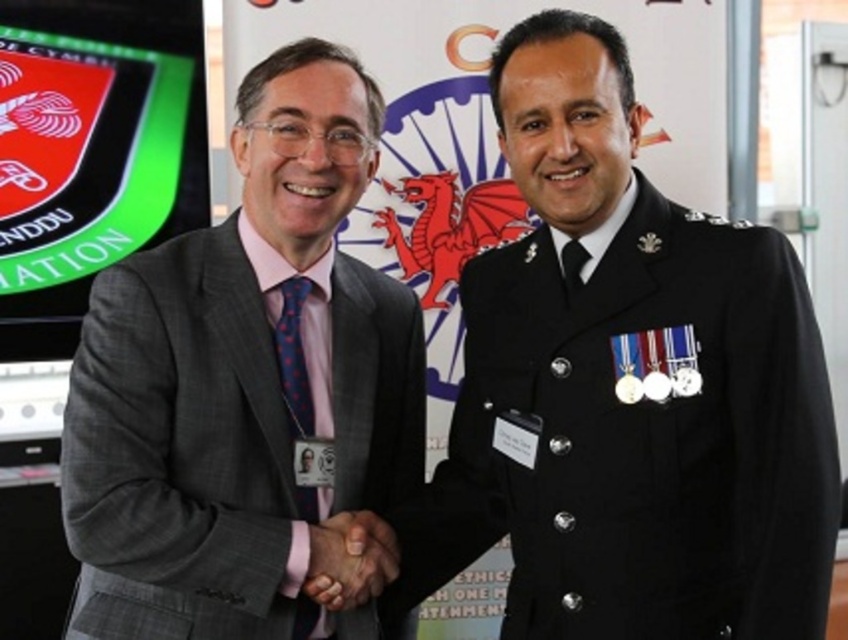
Who is shorter, black uniform at center or black satin tie at right?

Result: black satin tie at right

Can you confirm if black uniform at center is thinner than black satin tie at right?

Incorrect, black uniform at center's width is not less than black satin tie at right's.

Who is more forward, (590, 538) or (568, 269)?

Point (590, 538) is in front.

I want to click on black uniform at center, so click(x=628, y=388).

Is point (517, 177) positioned in front of point (300, 602)?

Yes.

In the scene shown: Which is below, black uniform at center or blue dotted tie at center?

blue dotted tie at center is below.

The width and height of the screenshot is (848, 640). What do you see at coordinates (628, 388) in the screenshot? I see `black uniform at center` at bounding box center [628, 388].

This screenshot has height=640, width=848. Find the location of `black uniform at center`. black uniform at center is located at coordinates (628, 388).

Is black uniform at center to the left of matte black hands at center from the viewer's perspective?

No, black uniform at center is not to the left of matte black hands at center.

Between point (551, 364) and point (336, 609), which one is positioned in front?

Point (551, 364)

Where is `black uniform at center`? black uniform at center is located at coordinates (628, 388).